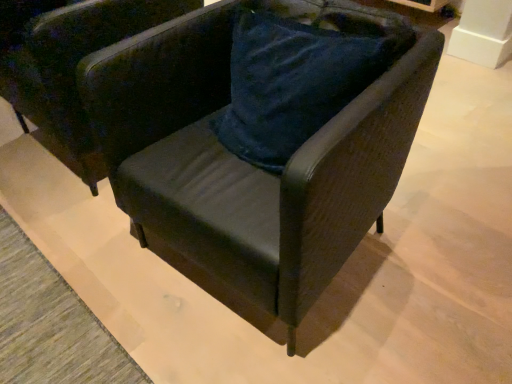
Question: Is velvet dark green armchair at center, acting as the first chair starting from the left, shorter than velvet dark green armchair at center, the 2th chair viewed from the left?

Choices:
 (A) yes
 (B) no

Answer: (A)

Question: Does velvet dark green armchair at center, acting as the first chair starting from the left, have a lesser width compared to velvet dark green armchair at center, the 2th chair viewed from the left?

Choices:
 (A) yes
 (B) no

Answer: (B)

Question: Is velvet dark green armchair at center, the 2th chair positioned from the right, at the right side of velvet dark green armchair at center, the 1th chair in the right-to-left sequence?

Choices:
 (A) no
 (B) yes

Answer: (A)

Question: Is velvet dark green armchair at center, acting as the first chair starting from the left, turned away from velvet dark green armchair at center, the 2th chair viewed from the left?

Choices:
 (A) yes
 (B) no

Answer: (B)

Question: Does velvet dark green armchair at center, acting as the first chair starting from the left, lie behind velvet dark green armchair at center, the 1th chair in the right-to-left sequence?

Choices:
 (A) no
 (B) yes

Answer: (B)

Question: Are velvet dark green armchair at center, the 2th chair positioned from the right, and velvet dark green armchair at center, the 2th chair viewed from the left, beside each other?

Choices:
 (A) no
 (B) yes

Answer: (A)

Question: Is velvet dark green armchair at center, the 1th chair in the right-to-left sequence, shorter than velvet dark green armchair at center, acting as the first chair starting from the left?

Choices:
 (A) no
 (B) yes

Answer: (A)

Question: From the image's perspective, is velvet dark green armchair at center, the 1th chair in the right-to-left sequence, below velvet dark green armchair at center, the 2th chair positioned from the right?

Choices:
 (A) no
 (B) yes

Answer: (B)

Question: Is velvet dark green armchair at center, acting as the first chair starting from the left, at the back of velvet dark green armchair at center, the 2th chair viewed from the left?

Choices:
 (A) no
 (B) yes

Answer: (A)

Question: Is velvet dark green armchair at center, the 1th chair in the right-to-left sequence, to the left of velvet dark green armchair at center, the 2th chair positioned from the right, from the viewer's perspective?

Choices:
 (A) yes
 (B) no

Answer: (B)

Question: Would you say velvet dark green armchair at center, the 1th chair in the right-to-left sequence, contains velvet dark green armchair at center, acting as the first chair starting from the left?

Choices:
 (A) yes
 (B) no

Answer: (B)

Question: From a real-world perspective, is velvet dark green armchair at center, the 2th chair viewed from the left, on top of velvet dark green armchair at center, acting as the first chair starting from the left?

Choices:
 (A) no
 (B) yes

Answer: (A)

Question: Looking at the image, does velvet dark green armchair at center, the 2th chair viewed from the left, seem bigger or smaller compared to velvet dark green armchair at center, acting as the first chair starting from the left?

Choices:
 (A) big
 (B) small

Answer: (B)